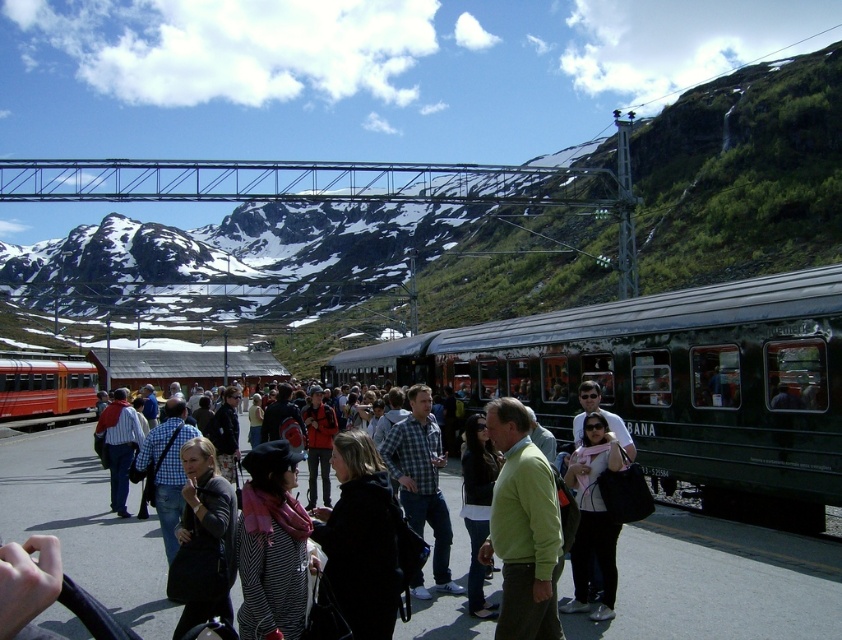
You are a photographer standing at the train station. You want to take a photo of the green matte train at center and the matte black people at center. Based on their positions, which one will appear closer to the camera in the photo?

The green matte train at center will appear closer to the camera in the photo because the matte black people at center are positioned behind it.

You are a photographer standing at the train station and want to capture a photo of the two people wearing the green sweater at center and the matte black jacket at center. Which clothing item is positioned higher on the person?

The green sweater at center is located above the matte black jacket at center, so the green sweater at center is positioned higher on the person.

You are a photographer standing at the train station and want to take a photo of both the green matte train at center and the green sweater at center. Which object should you focus on first to ensure it appears sharp in the photo?

You should focus on the green matte train at center first because it is closer to you than the green sweater at center, ensuring it will be in focus before adjusting for the sweater.